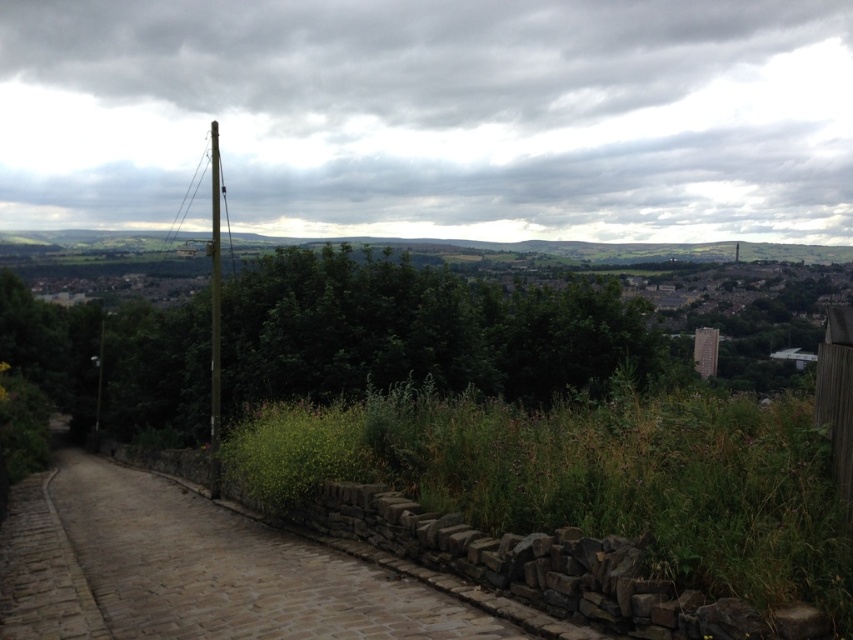
From the picture: Based on the scene description, where is the green leafy tree at center located in the image?

The green leafy tree at center is located at point (416, 330) in the image.

You are standing at the elevated vantage point looking at the cobblestone pathway and the wooden post. There are two points marked on the image at coordinates point (312, 308) and point (55, 486). Which of these two points is nearer to your current position?

Point (312, 308) is closer to the camera than point (55, 486), so the point at (312, 308) is nearer to your current position.